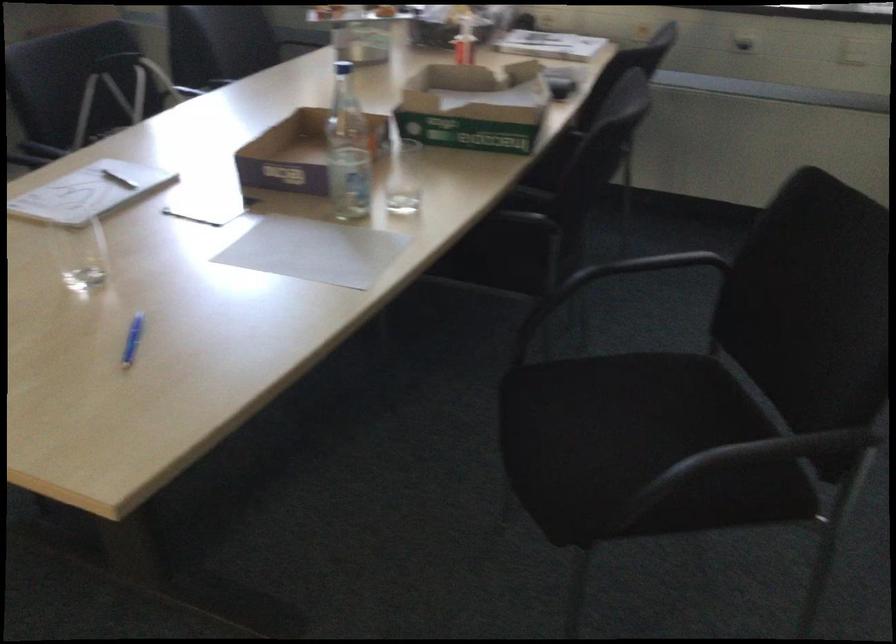
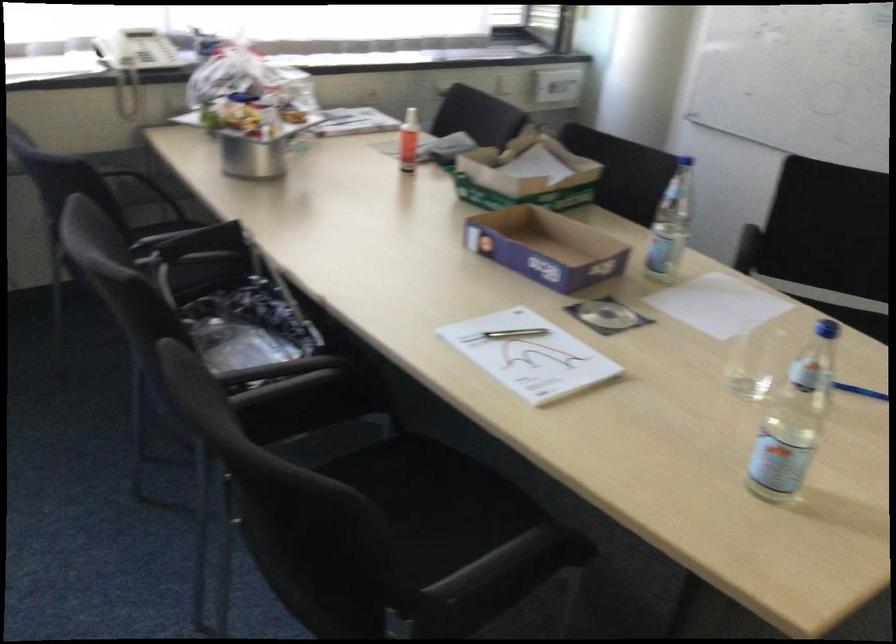
Find the pixel in the second image that matches (x=153, y=292) in the first image.

(754, 362)